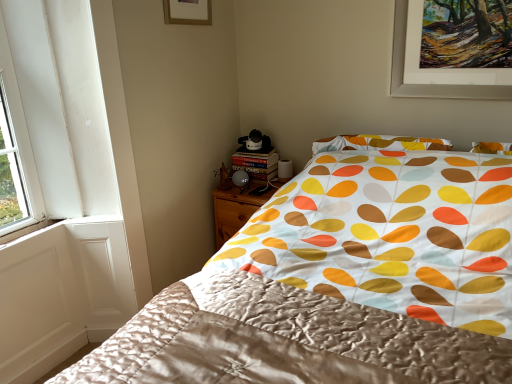
Question: Is silky fabric bed at center bigger than silky satin blanket at center?

Choices:
 (A) yes
 (B) no

Answer: (A)

Question: Considering the relative sizes of silky fabric bed at center and silky satin blanket at center in the image provided, is silky fabric bed at center smaller than silky satin blanket at center?

Choices:
 (A) no
 (B) yes

Answer: (A)

Question: Is silky fabric bed at center at the right side of silky satin blanket at center?

Choices:
 (A) no
 (B) yes

Answer: (B)

Question: Would you say silky fabric bed at center contains silky satin blanket at center?

Choices:
 (A) no
 (B) yes

Answer: (B)

Question: Are silky fabric bed at center and silky satin blanket at center located far from each other?

Choices:
 (A) yes
 (B) no

Answer: (B)

Question: In terms of width, does silky satin blanket at center look wider or thinner when compared to matte gold picture frame at upper center?

Choices:
 (A) thin
 (B) wide

Answer: (B)

Question: From a real-world perspective, is silky satin blanket at center positioned above or below matte gold picture frame at upper center?

Choices:
 (A) above
 (B) below

Answer: (B)

Question: Is point (134, 316) positioned closer to the camera than point (205, 19)?

Choices:
 (A) closer
 (B) farther

Answer: (A)

Question: Is silky satin blanket at center in front of or behind matte gold picture frame at upper center in the image?

Choices:
 (A) behind
 (B) front

Answer: (B)

Question: From a real-world perspective, relative to silky fabric bed at center, is wooden nightstand at lower center vertically above or below?

Choices:
 (A) above
 (B) below

Answer: (B)

Question: From their relative heights in the image, would you say wooden nightstand at lower center is taller or shorter than silky fabric bed at center?

Choices:
 (A) tall
 (B) short

Answer: (B)

Question: Choose the correct answer: Is wooden nightstand at lower center inside silky fabric bed at center or outside it?

Choices:
 (A) inside
 (B) outside

Answer: (B)

Question: Would you say wooden nightstand at lower center is to the left or to the right of silky fabric bed at center in the picture?

Choices:
 (A) right
 (B) left

Answer: (B)

Question: Looking at their shapes, would you say matte gold picture frame at upper center is wider or thinner than silky fabric bed at center?

Choices:
 (A) thin
 (B) wide

Answer: (A)

Question: Would you say matte gold picture frame at upper center is inside or outside silky fabric bed at center?

Choices:
 (A) inside
 (B) outside

Answer: (B)